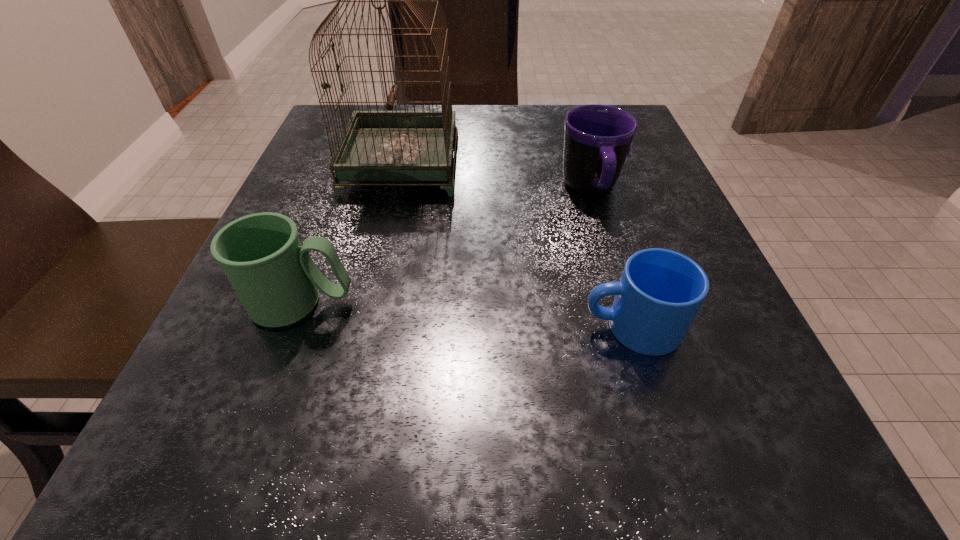
You are a GUI agent. You are given a task and a screenshot of the screen. Output one action in this format:
    pyautogui.click(x=<x>, y=<y>)
    Task: Click on the vacant area that lies between the shortest mug and the birdcage
    Image resolution: width=960 pixels, height=540 pixels.
    Given the screenshot: What is the action you would take?
    pyautogui.click(x=516, y=246)

The height and width of the screenshot is (540, 960). Find the location of `unoccupied area between the farthest mug and the shortest mug`. unoccupied area between the farthest mug and the shortest mug is located at coordinates (611, 258).

This screenshot has height=540, width=960. Find the location of `vacant space in between the tallest object and the farthest mug`. vacant space in between the tallest object and the farthest mug is located at coordinates (496, 177).

Locate an element on the screen. The image size is (960, 540). empty location between the tallest object and the shortest object is located at coordinates (516, 246).

Locate an element on the screen. free area in between the farthest mug and the tallest object is located at coordinates (496, 177).

At what (x,y) coordinates should I click in order to perform the action: click on vacant space that's between the shortest object and the birdcage. Please return your answer as a coordinate pair (x, y). Looking at the image, I should click on (516, 246).

At what (x,y) coordinates should I click in order to perform the action: click on free point between the leftmost mug and the farthest mug. Please return your answer as a coordinate pair (x, y). Looking at the image, I should click on (446, 246).

Locate an element on the screen. vacant area between the shortest mug and the birdcage is located at coordinates (516, 246).

Find the location of a particular element. The height and width of the screenshot is (540, 960). free space that is in between the tallest object and the shortest object is located at coordinates (516, 246).

I want to click on free area in between the birdcage and the shortest object, so click(516, 246).